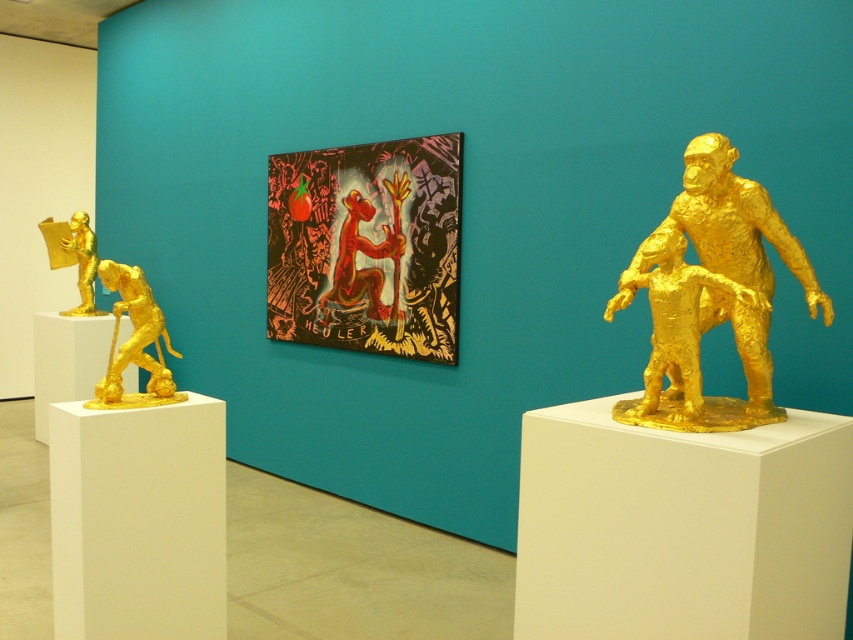
You are an art curator planning to rearrange the sculptures in the gallery. You want to move the gold metallic figure at left to the right side of the gold textured sculpture at right. Is this possible without overlapping them?

The gold textured sculpture at right is located below the gold metallic figure at left, so moving the gold metallic figure at left to the right side of the gold textured sculpture at right would require adjusting their vertical positions since they are currently aligned vertically rather than horizontally. This might be possible depending on the available space, but the description does not provide information about horizontal positioning or the size of the sculptures.

You are an art curator standing in front of the art gallery wall. You need to place a new golden sculpture exactly between the shiny red tomato at center and the gold metallic figure at right. Is there enough space between them to fit the sculpture?

The shiny red tomato at center is to the left of gold metallic figure at right, so there is space between them to place the new golden sculpture exactly in between.